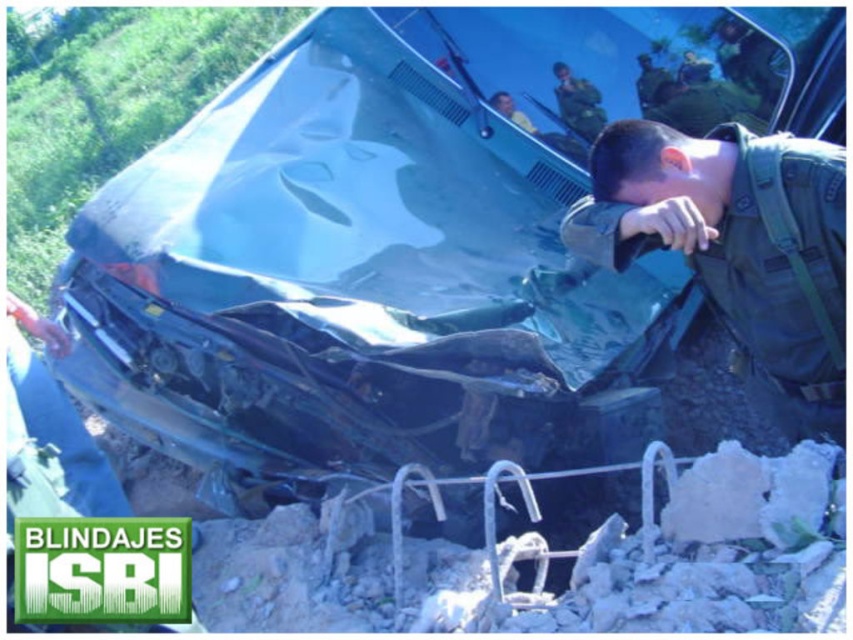
You are a bystander observing the accident scene. You notice two uniforms in the image. The first is a dark green uniform at center, and the second is a green matte uniform at upper center. Which of these uniforms is taller in the image?

The dark green uniform at center is much taller than the green matte uniform at upper center in the image.